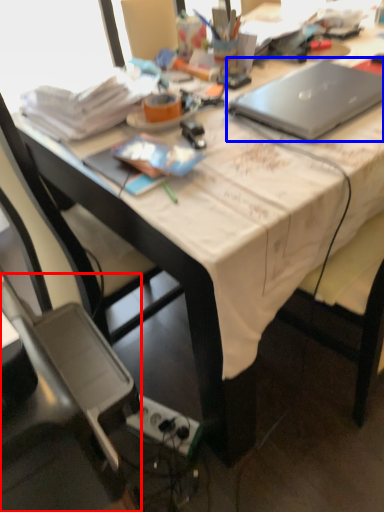
Question: Which object appears closest to the camera in this image, chair (highlighted by a red box) or laptop (highlighted by a blue box)?

Choices:
 (A) chair
 (B) laptop

Answer: (A)